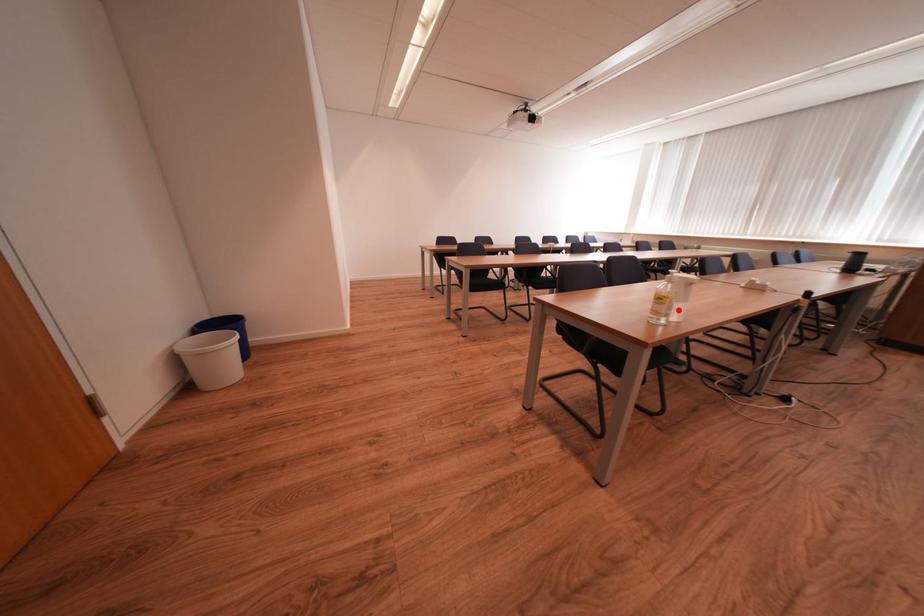
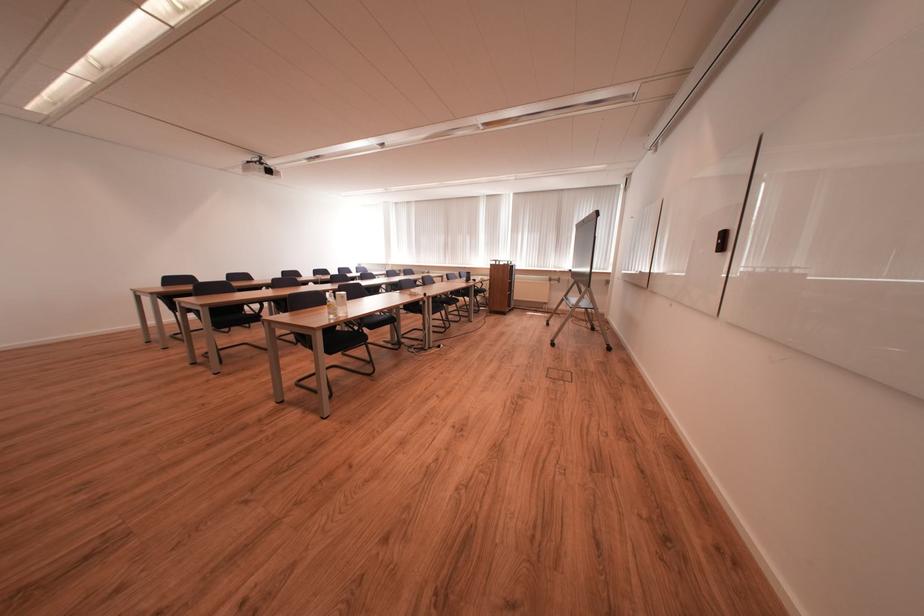
Question: I am providing you with two images of the same scene from different viewpoints. A red point is marked on the first image. At the location where the point appears in image 1, is it still visible in image 2?

Choices:
 (A) Yes
 (B) No

Answer: (A)